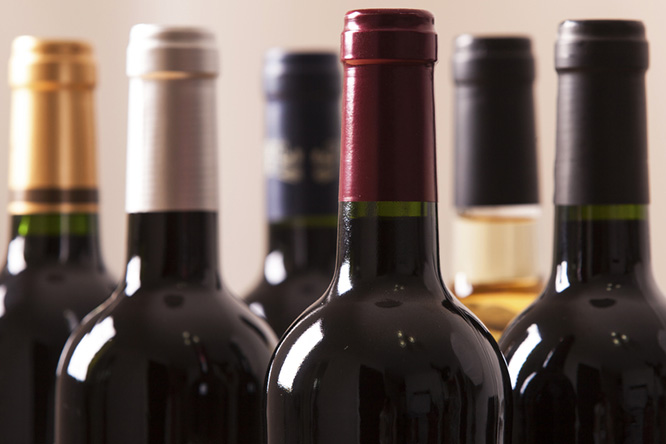
Locate an element on the screen. Image resolution: width=666 pixels, height=444 pixels. wine bottle is located at coordinates (621, 347), (356, 361), (166, 327), (41, 274), (284, 271), (500, 253).